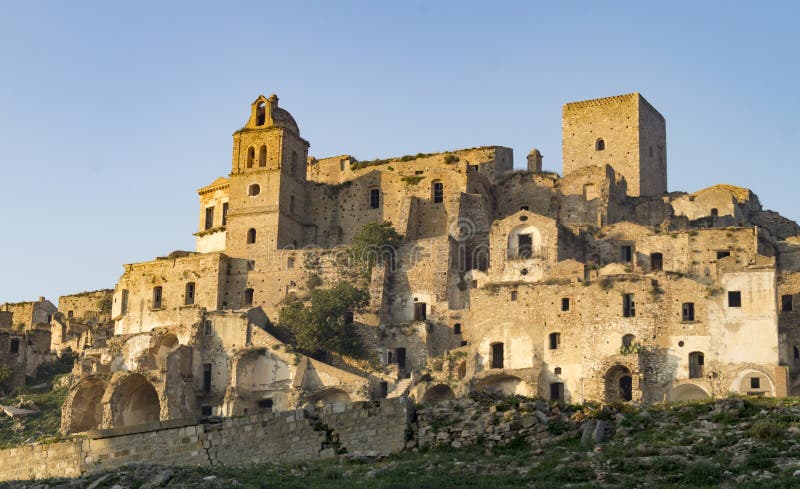
The image size is (800, 489). I want to click on door, so click(x=622, y=387).